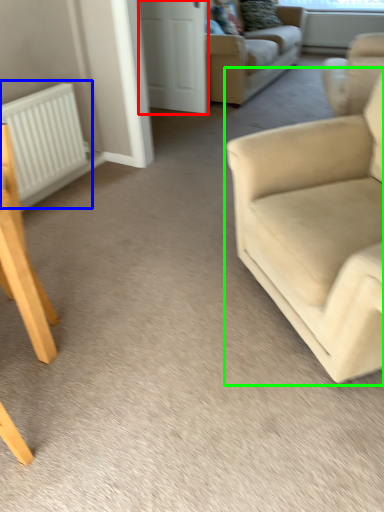
Question: Which object is positioned farthest from glass door (highlighted by a red box)? Select from radiator (highlighted by a blue box) and studio couch (highlighted by a green box).

Choices:
 (A) radiator
 (B) studio couch

Answer: (B)